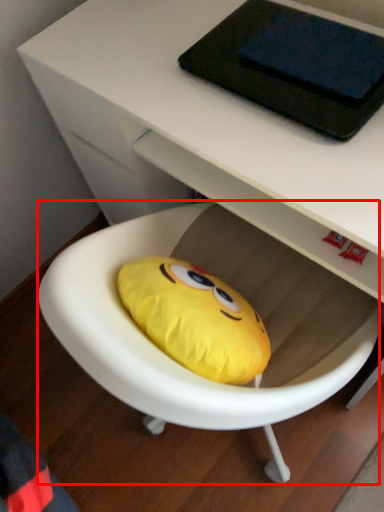
Question: From the image's perspective, considering the relative positions of bean bag chair (annotated by the red box) and tablet computer in the image provided, where is bean bag chair (annotated by the red box) located with respect to the staircase?

Choices:
 (A) above
 (B) below

Answer: (B)